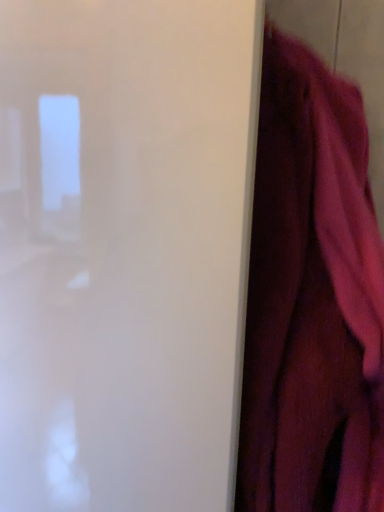
Locate an element on the screen. velvet burgundy curtain at right is located at coordinates (312, 296).

Describe the element at coordinates (312, 296) in the screenshot. The image size is (384, 512). I see `velvet burgundy curtain at right` at that location.

This screenshot has height=512, width=384. In order to click on velvet burgundy curtain at right in this screenshot , I will do `click(312, 296)`.